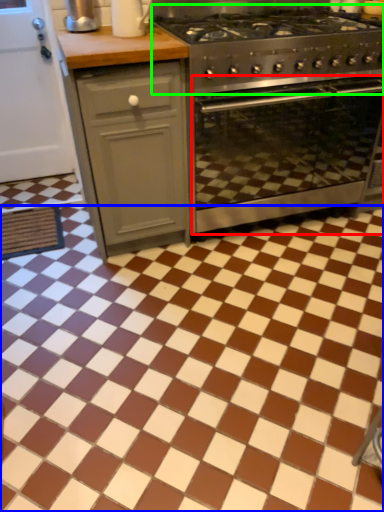
Question: Estimate the real-world distances between objects in this image. Which object is farther from oven (highlighted by a red box), ceramic tile (highlighted by a blue box) or gas stove (highlighted by a green box)?

Choices:
 (A) ceramic tile
 (B) gas stove

Answer: (A)